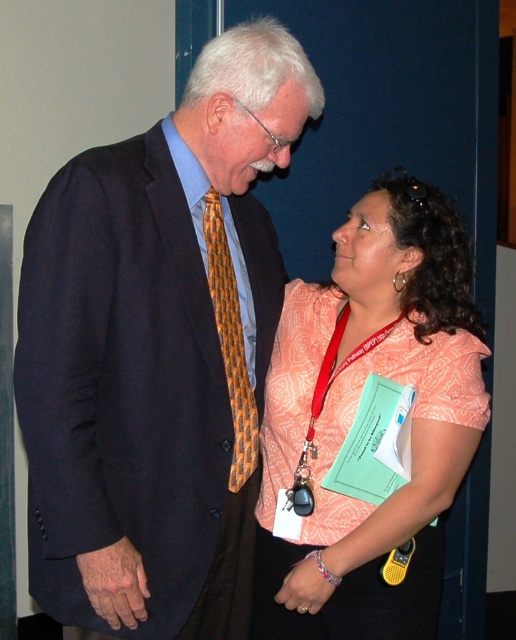
Please describe the location of the point marked at coordinates [157,353] in the image. Which object does this point correspond to?

The point at coordinates [157,353] corresponds to the matte black suit at left.

You are standing at the point labeled as point (239, 170) in the image. You want to greet the person on the left wearing a navy suit jacket. Can you reach them without moving from your current position?

The distance between point (239, 170) and the viewer is 4.99 feet. Since you are at point (239, 170), you are 4.99 feet away from the person on the left wearing a navy suit jacket. This distance allows you to greet them without needing to move closer.

You are an event coordinator arranging seating for a formal event. You need to place two guests based on their attire. The guests are wearing a patterned fabric blouse at center and an orange woven tie at center. According to the image, which guest should be seated closer to the front row to ensure their attire is visible from the audience? Explain your reasoning.

The orange woven tie at center should be seated closer to the front row because it is located above the patterned fabric blouse at center in the image. Placing it higher in the seating arrangement would maintain its visibility from the audience perspective.